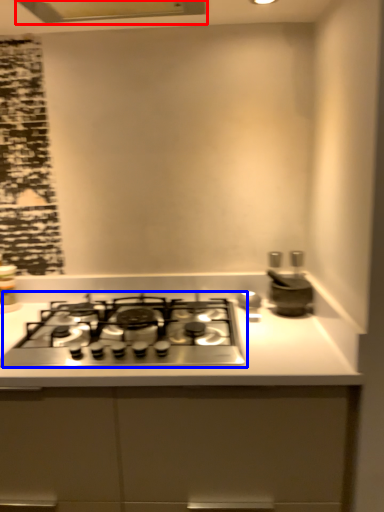
Question: Among these objects, which one is farthest to the camera, exhaust hood (highlighted by a red box) or gas stove (highlighted by a blue box)?

Choices:
 (A) exhaust hood
 (B) gas stove

Answer: (A)